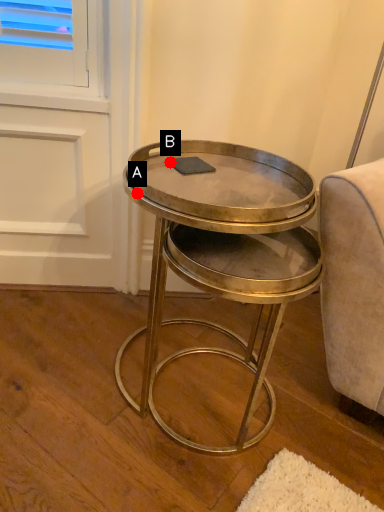
Question: Two points are circled on the image, labeled by A and B beside each circle. Which point is further to the camera?

Choices:
 (A) A is further
 (B) B is further

Answer: (B)